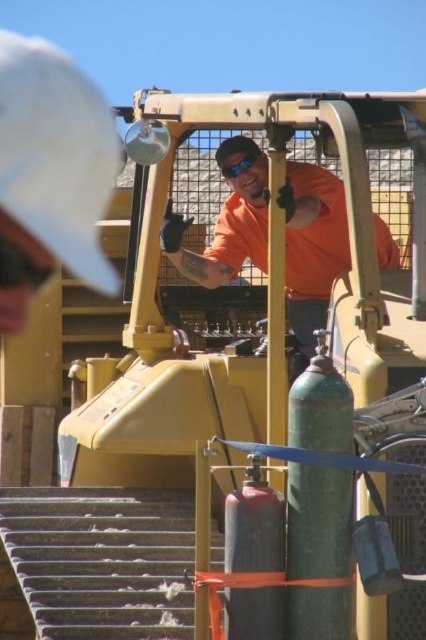
What is the color of the fabric at the point with coordinates (x=55, y=152)?

The point at coordinates (x=55, y=152) is on a white fabric cap at upper left.